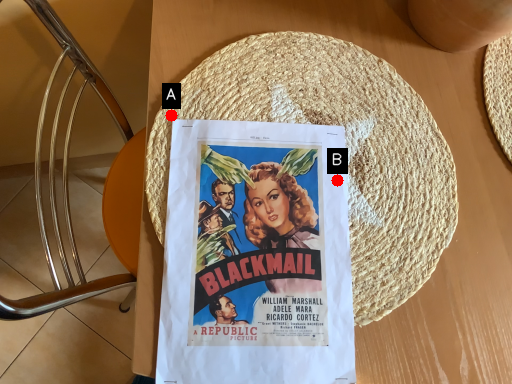
Question: Two points are circled on the image, labeled by A and B beside each circle. Which point is closer to the camera?

Choices:
 (A) A is closer
 (B) B is closer

Answer: (B)